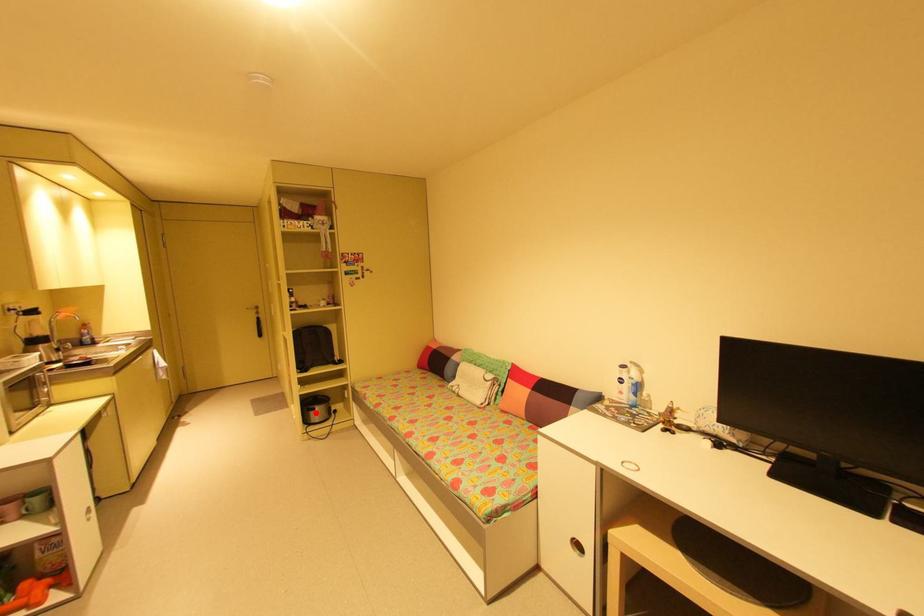
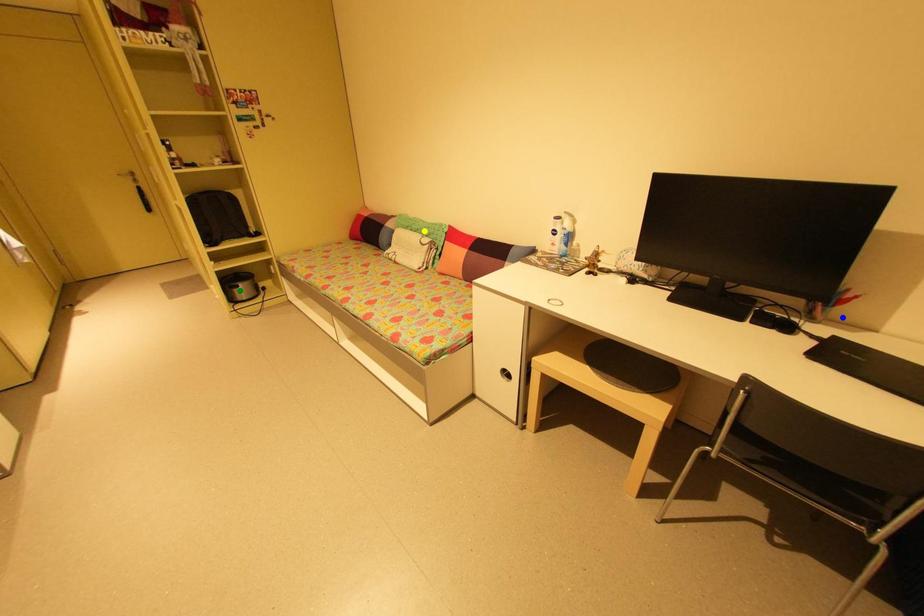
Question: I am providing you with two images of the same scene from different viewpoints. A red point is marked on the first image. You are given multiple points on the second image. Which mark in image 2 goes with the point in image 1?

Choices:
 (A) blue point
 (B) yellow point
 (C) green point

Answer: (C)